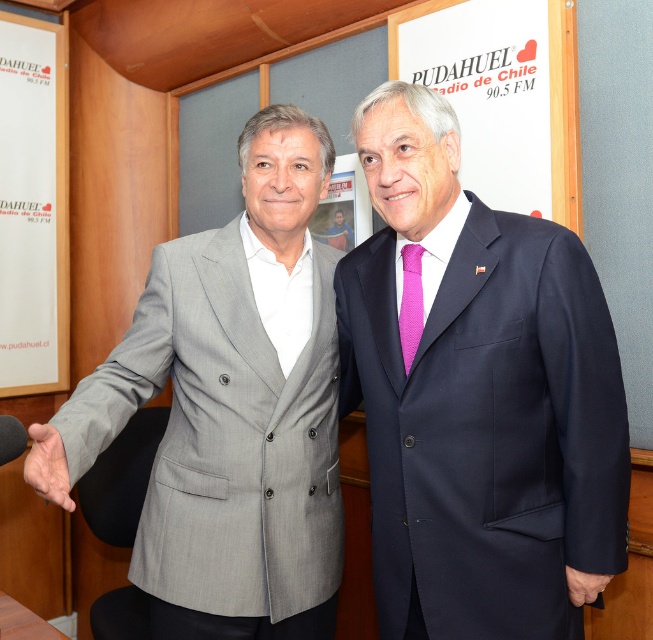
The image size is (653, 640). Find the location of `dark blue suit at center`. dark blue suit at center is located at coordinates (477, 394).

Who is lower down, dark blue suit at center or matte gray suit at center?

dark blue suit at center is lower down.

What do you see at coordinates (477, 394) in the screenshot?
I see `dark blue suit at center` at bounding box center [477, 394].

Find the location of a particular element. The height and width of the screenshot is (640, 653). dark blue suit at center is located at coordinates (477, 394).

Which of these two, smooth skin hand at center or pink dotted tie at center, stands taller?

pink dotted tie at center

Identify the location of smooth skin hand at center. This screenshot has width=653, height=640. (48, 465).

Image resolution: width=653 pixels, height=640 pixels. Identify the location of smooth skin hand at center. (48, 465).

Between matte black hand at lower right and matte gray suit at center, which one is positioned lower?

Positioned lower is matte black hand at lower right.

Can you confirm if matte black hand at lower right is smaller than matte gray suit at center?

Yes.

Where is `matte black hand at lower right`? This screenshot has height=640, width=653. matte black hand at lower right is located at coordinates (584, 586).